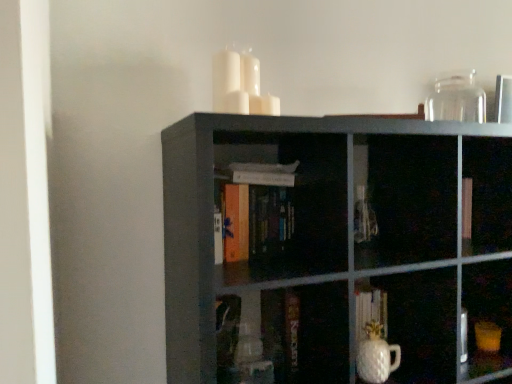
Question: Is orange matte book at center not within transparent glass jar at upper right, the second glass vase positioned from the bottom?

Choices:
 (A) yes
 (B) no

Answer: (A)

Question: From a real-world perspective, is orange matte book at center positioned over transparent glass jar at upper right, the first glass vase in the right-to-left sequence, based on gravity?

Choices:
 (A) no
 (B) yes

Answer: (A)

Question: Is orange matte book at center aimed at transparent glass jar at upper right, the 2th glass vase when ordered from front to back?

Choices:
 (A) yes
 (B) no

Answer: (B)

Question: Is orange matte book at center at the left side of transparent glass jar at upper right, the second glass vase positioned from the bottom?

Choices:
 (A) no
 (B) yes

Answer: (B)

Question: Can you confirm if orange matte book at center is taller than transparent glass jar at upper right, the second glass vase positioned from the bottom?

Choices:
 (A) yes
 (B) no

Answer: (A)

Question: From the image's perspective, is orange matte book at center under transparent glass jar at upper right, which appears as the first glass vase when viewed from the top?

Choices:
 (A) no
 (B) yes

Answer: (B)

Question: Does transparent glass jar at upper right, the 2th glass vase when ordered from front to back, have a smaller size compared to white glossy vase at lower center, the first glass vase from the left?

Choices:
 (A) yes
 (B) no

Answer: (B)

Question: From a real-world perspective, is transparent glass jar at upper right, the second glass vase positioned from the bottom, on white glossy vase at lower center, the second glass vase from the top?

Choices:
 (A) no
 (B) yes

Answer: (B)

Question: Does transparent glass jar at upper right, the second glass vase positioned from the bottom, have a larger size compared to white glossy vase at lower center, the second glass vase from the right?

Choices:
 (A) no
 (B) yes

Answer: (B)

Question: Is the depth of transparent glass jar at upper right, the 2th glass vase when ordered from front to back, greater than that of white glossy vase at lower center, the first glass vase from the left?

Choices:
 (A) yes
 (B) no

Answer: (A)

Question: From the image's perspective, is transparent glass jar at upper right, the first glass vase in the right-to-left sequence, over white glossy vase at lower center, the second glass vase from the right?

Choices:
 (A) yes
 (B) no

Answer: (A)

Question: Is transparent glass jar at upper right, which appears as the first glass vase when viewed from the top, facing away from white glossy vase at lower center, the second glass vase from the right?

Choices:
 (A) yes
 (B) no

Answer: (B)

Question: Is matte black bookshelf at center outside of white glossy vase at lower center, the first glass vase in the bottom-to-top sequence?

Choices:
 (A) no
 (B) yes

Answer: (B)